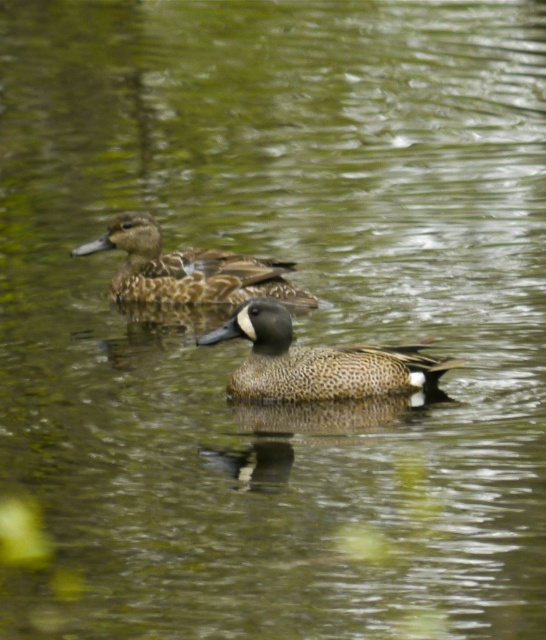
You are standing on the bank of the pond and want to throw a small treat to the speckled feathered duck at center. The treat can travel 15 feet. Will it reach the duck?

The distance between the two ducks is 17.35 feet, which is greater than the treat travel distance of 15 feet. The treat will not reach the speckled feathered duck at center.

You are a wildlife photographer aiming to capture a photo of both the speckled feathered duck at center and the brown speckled duck at upper center. Based on their sizes, which duck would appear smaller in the final photo?

The speckled feathered duck at center would appear smaller in the final photo because it has a lesser height compared to the brown speckled duck at upper center.

You are standing at the edge of the pond and see two points marked on the water surface. The first point is at coordinate point [395,388] and the second is at point [198,289]. Which point is closer to you?

Point [395,388] is in front of point [198,289], so it is closer to you.